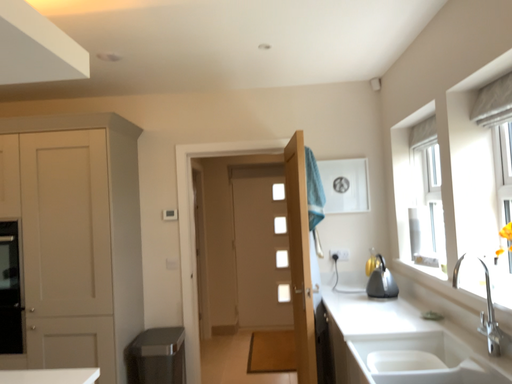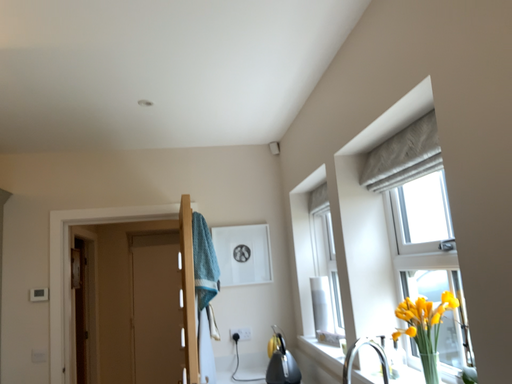
Question: How did the camera likely rotate when shooting the video?

Choices:
 (A) rotated right
 (B) rotated left

Answer: (A)